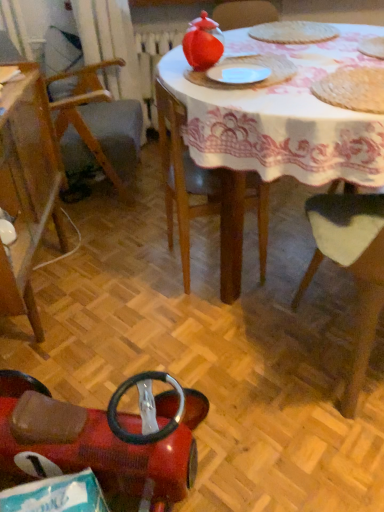
This screenshot has width=384, height=512. Identify the location of vacant space positioned to the left of white matte paper plate at center. (184, 81).